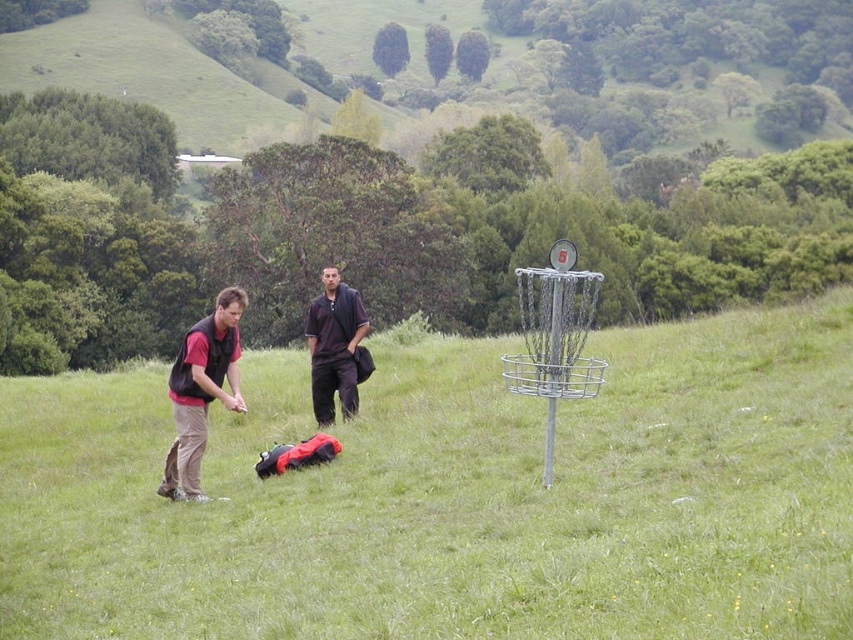
You are a hiker who wants to walk from the green grassy field at center to the brushed metal vest at left. Is the path directly between them clear of any obstacles?

The green grassy field at center is positioned over the brushed metal vest at left, so there are no obstacles between them. The path is clear.

You are a hiker who wants to cross the green grassy field at center but need to avoid getting your dark matte shirt at center dirty. Which object should you walk over to stay clean?

The green grassy field at center is much taller than the dark matte shirt at center, so walking over the green grassy field at center would keep your dark matte shirt at center clean as it won

You are a disc golf player who needs to retrieve your disc from the basket. You are currently standing at the position of the dark matte shirt at center. The basket is located to your right. Can you step back to the matte black vest at left to get a better angle for retrieving the disc without moving more than 1.2 meters?

The distance between the matte black vest at left and dark matte shirt at center is 1.04 meters. Since 1.04 meters is less than 1.2 meters, you can step back to the matte black vest at left to get a better angle without exceeding the 1.2 meter limit.